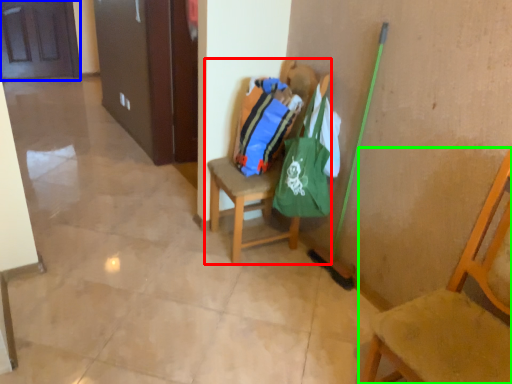
Question: Which is nearer to the chair (highlighted by a red box)? door (highlighted by a blue box) or chair (highlighted by a green box).

Choices:
 (A) door
 (B) chair

Answer: (B)